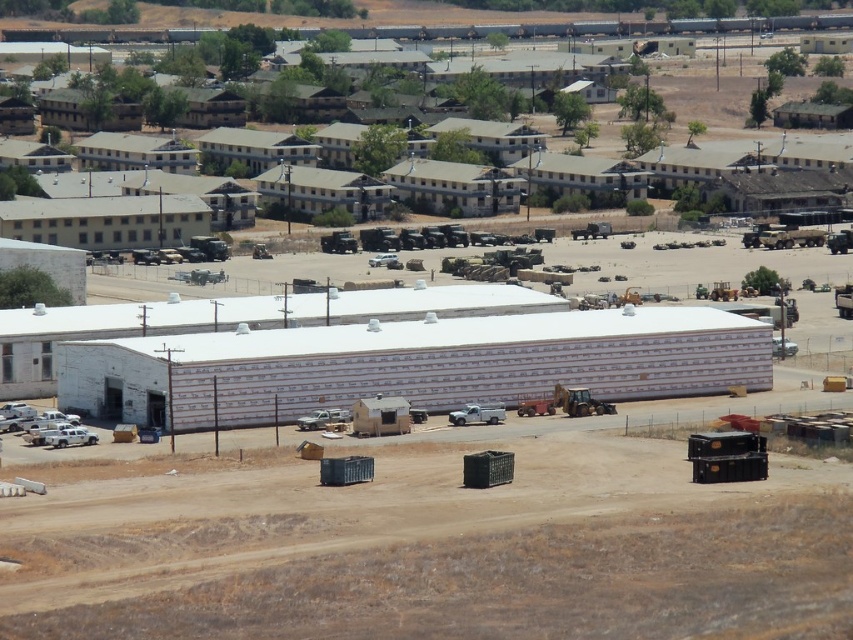
Question: Observing the image, what is the correct spatial positioning of brown dirt field at lower center in reference to gray concrete buildings at upper center?

Choices:
 (A) right
 (B) left

Answer: (B)

Question: Which point is farther to the camera?

Choices:
 (A) brown dirt field at lower center
 (B) gray concrete buildings at upper center

Answer: (B)

Question: Is brown dirt field at lower center to the left of gray concrete buildings at upper center from the viewer's perspective?

Choices:
 (A) yes
 (B) no

Answer: (A)

Question: Does brown dirt field at lower center appear on the left side of gray concrete buildings at upper center?

Choices:
 (A) no
 (B) yes

Answer: (B)

Question: Which of the following is the closest to the observer?

Choices:
 (A) (492, 576)
 (B) (93, 33)

Answer: (A)

Question: Which of the following is the farthest from the observer?

Choices:
 (A) (503, 627)
 (B) (471, 35)

Answer: (B)